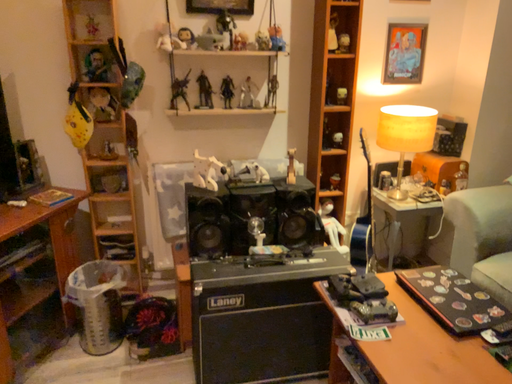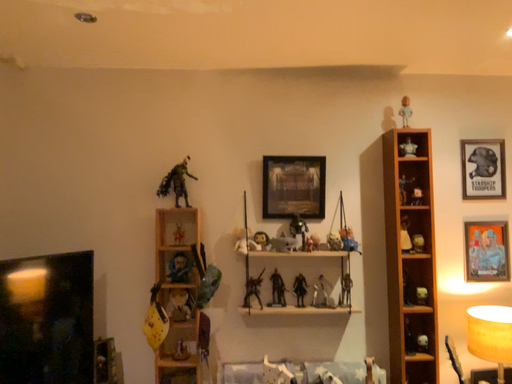
Question: Which way did the camera rotate in the video?

Choices:
 (A) rotated upward
 (B) rotated downward

Answer: (A)